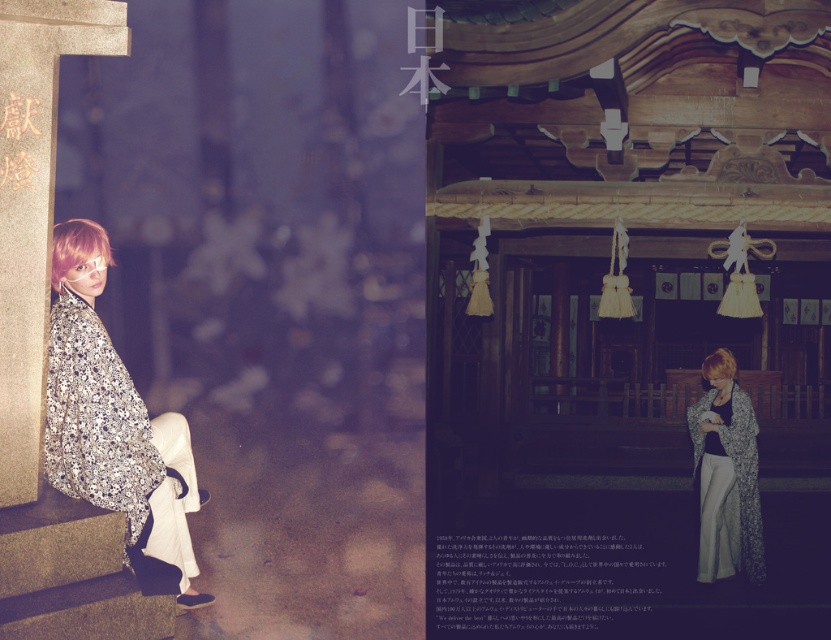
Question: Estimate the real-world distances between objects in this image. Which object is farther from the floral kimono at center?

Choices:
 (A) black paper at lower center
 (B) silver metallic kimono at left

Answer: (B)

Question: Based on their relative distances, which object is farther from the black paper at lower center?

Choices:
 (A) silver metallic kimono at left
 (B) floral kimono at center

Answer: (A)

Question: Can you confirm if silver metallic kimono at left is positioned above black paper at lower center?

Choices:
 (A) yes
 (B) no

Answer: (A)

Question: Does silver metallic kimono at left have a smaller size compared to floral kimono at center?

Choices:
 (A) yes
 (B) no

Answer: (B)

Question: Does silver metallic kimono at left appear on the left side of black paper at lower center?

Choices:
 (A) yes
 (B) no

Answer: (A)

Question: Which object is farther from the camera taking this photo?

Choices:
 (A) floral kimono at center
 (B) silver metallic kimono at left

Answer: (A)